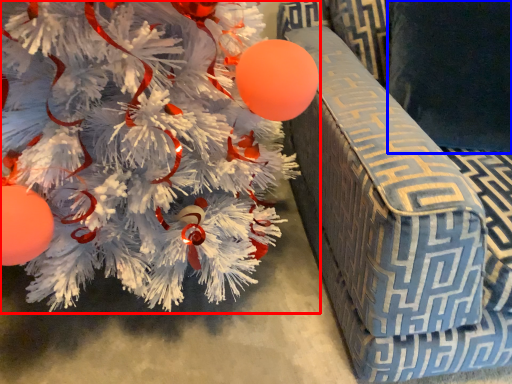
Question: Which object appears closest to the camera in this image, christmas tree (highlighted by a red box) or pillow (highlighted by a blue box)?

Choices:
 (A) christmas tree
 (B) pillow

Answer: (A)